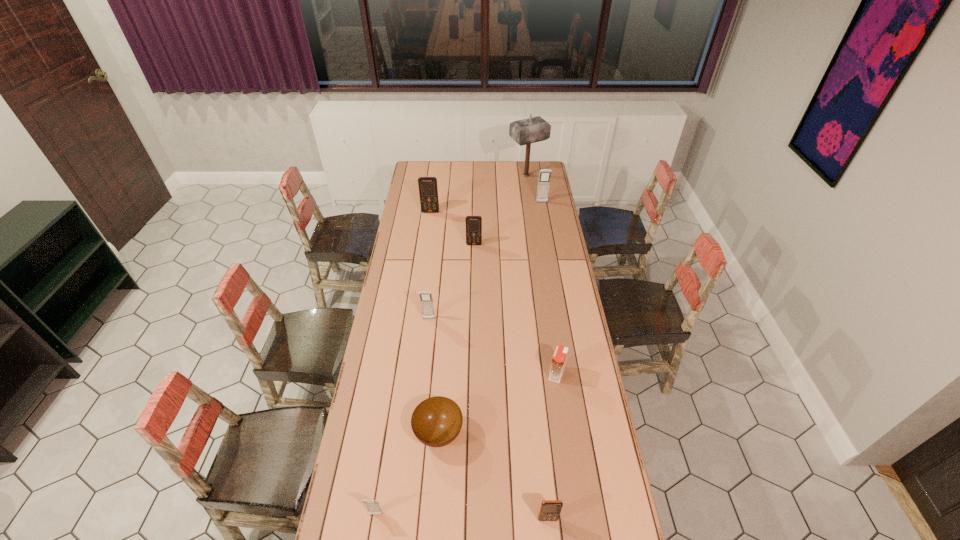
Find the location of a particular element. The width and height of the screenshot is (960, 540). vacant space at the left edge of the desktop is located at coordinates (409, 286).

This screenshot has height=540, width=960. What are the coordinates of `vacant region at the right edge` in the screenshot? It's located at (611, 500).

Where is `free space at the far left corner of the desktop`? Image resolution: width=960 pixels, height=540 pixels. free space at the far left corner of the desktop is located at coordinates (414, 178).

Find the location of a particular element. This screenshot has height=540, width=960. vacant area at the far right corner of the desktop is located at coordinates (540, 161).

Identify the location of free space that is in between the nearest gray cellular telephone and the orange orange juice. Image resolution: width=960 pixels, height=540 pixels. (466, 444).

The height and width of the screenshot is (540, 960). Identify the location of free space between the rightmost orange cellular telephone and the biggest orange cellular telephone. (490, 366).

Locate an element on the screen. Image resolution: width=960 pixels, height=540 pixels. free spot between the orange orange juice and the seventh farthest object is located at coordinates (497, 404).

Where is `free space between the fourth nearest object and the second cellular telephone from right to left`? Image resolution: width=960 pixels, height=540 pixels. free space between the fourth nearest object and the second cellular telephone from right to left is located at coordinates (552, 447).

This screenshot has width=960, height=540. Identify the location of blank region between the smallest orange cellular telephone and the biggest orange cellular telephone. (490, 366).

The height and width of the screenshot is (540, 960). I want to click on free space between the rightmost gray cellular telephone and the rightmost orange cellular telephone, so click(x=545, y=361).